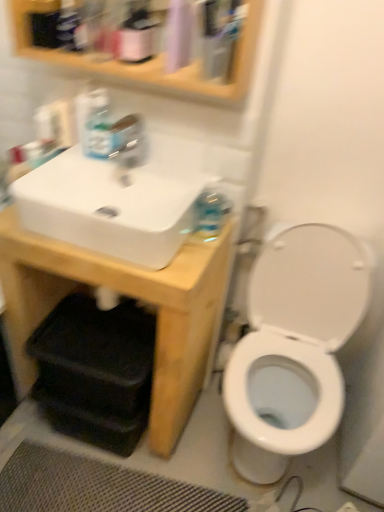
This screenshot has height=512, width=384. In order to click on white matte sink at upper left in this screenshot , I will do `click(128, 296)`.

Where is `clear plastic mouthwash at upper center`? This screenshot has width=384, height=512. clear plastic mouthwash at upper center is located at coordinates (219, 37).

In order to face clear plastic mouthwash at upper center, should I rotate leftwards or rightwards?

Rotate right and turn 3.587 degrees.

The image size is (384, 512). Describe the element at coordinates (115, 202) in the screenshot. I see `white glossy sink at upper left` at that location.

Image resolution: width=384 pixels, height=512 pixels. Find the location of `black textured bath mat at lower center`. black textured bath mat at lower center is located at coordinates (97, 486).

Locate an element on the screen. The height and width of the screenshot is (512, 384). white matte sink at upper left is located at coordinates (128, 296).

In the image, is wooden medicine cabinet at upper center positioned in front of or behind clear plastic mouthwash at upper center?

wooden medicine cabinet at upper center is positioned closer to the viewer than clear plastic mouthwash at upper center.

Between wooden medicine cabinet at upper center and clear plastic mouthwash at upper center, which one has larger width?

With larger width is wooden medicine cabinet at upper center.

Is wooden medicine cabinet at upper center next to clear plastic mouthwash at upper center?

wooden medicine cabinet at upper center and clear plastic mouthwash at upper center are not in contact.

From the image's perspective, would you say wooden medicine cabinet at upper center is positioned over clear plastic mouthwash at upper center?

Indeed, from the image's perspective, wooden medicine cabinet at upper center is shown above clear plastic mouthwash at upper center.

Who is smaller, matte pink spray bottle at upper center or wooden medicine cabinet at upper center?

With smaller size is matte pink spray bottle at upper center.

Is matte pink spray bottle at upper center oriented away from wooden medicine cabinet at upper center?

Absolutely, matte pink spray bottle at upper center is directed away from wooden medicine cabinet at upper center.

From a real-world perspective, does matte pink spray bottle at upper center stand above wooden medicine cabinet at upper center?

Yes.

Between wooden medicine cabinet at upper center and white glossy toilet at right, which one has more height?

With more height is white glossy toilet at right.

Is wooden medicine cabinet at upper center facing away from white glossy toilet at right?

No, white glossy toilet at right is not at the back of wooden medicine cabinet at upper center.

From a real-world perspective, which object stands above the other?

wooden medicine cabinet at upper center.

Which object is further away from the camera, wooden medicine cabinet at upper center or white glossy toilet at right?

Positioned behind is white glossy toilet at right.

Considering the relative positions of black textured bath mat at lower center and transparent plastic tap at upper center in the image provided, is black textured bath mat at lower center to the right of transparent plastic tap at upper center from the viewer's perspective?

No, black textured bath mat at lower center is not to the right of transparent plastic tap at upper center.

At what (x,y) coordinates should I click in order to perform the action: click on tap above the black textured bath mat at lower center (from a real-world perspective). Please return your answer as a coordinate pair (x, y). Looking at the image, I should click on (127, 145).

Between point (155, 478) and point (126, 173), which one is positioned behind?

The point (155, 478) is behind.

From the image's perspective, is black textured bath mat at lower center on transparent plastic tap at upper center?

No, from the image's perspective, black textured bath mat at lower center is not on top of transparent plastic tap at upper center.

The image size is (384, 512). In order to click on cleaning product behind the white glossy toilet at right in this screenshot , I will do `click(137, 34)`.

Choose the correct answer: Is matte pink spray bottle at upper center inside white glossy toilet at right or outside it?

matte pink spray bottle at upper center is spatially situated outside white glossy toilet at right.

In the image, is matte pink spray bottle at upper center positioned in front of or behind white glossy toilet at right?

matte pink spray bottle at upper center is behind white glossy toilet at right.

Considering the sizes of objects matte pink spray bottle at upper center and white glossy toilet at right in the image provided, who is shorter, matte pink spray bottle at upper center or white glossy toilet at right?

matte pink spray bottle at upper center.

Is matte pink spray bottle at upper center thinner than white matte sink at upper left?

Yes, matte pink spray bottle at upper center is thinner than white matte sink at upper left.

Which point is more distant from viewer, (141,28) or (151,426)?

Positioned behind is point (151,426).

From the image's perspective, who appears lower, matte pink spray bottle at upper center or white matte sink at upper left?

white matte sink at upper left.

Locate an element on the screen. This screenshot has height=512, width=384. mouthwash on the right of black textured bath mat at lower center is located at coordinates (219, 37).

From a real-world perspective, is clear plastic mouthwash at upper center under black textured bath mat at lower center?

Actually, clear plastic mouthwash at upper center is physically above black textured bath mat at lower center in the real world.

Locate an element on the screen. The width and height of the screenshot is (384, 512). medicine cabinet located in front of the clear plastic mouthwash at upper center is located at coordinates (150, 61).

Locate an element on the screen. cleaning product located on the left of wooden medicine cabinet at upper center is located at coordinates (137, 34).

Which object lies further to the anchor point matte pink spray bottle at upper center, wooden medicine cabinet at upper center or white glossy sink at upper left?

white glossy sink at upper left.

Based on their spatial positions, is wooden medicine cabinet at upper center or black textured bath mat at lower center further from clear plastic mouthwash at upper center?

black textured bath mat at lower center.

Consider the image. Considering their positions, is white glossy sink at upper left positioned closer to black textured bath mat at lower center than clear plastic mouthwash at upper center?

The object closer to black textured bath mat at lower center is white glossy sink at upper left.

Considering their positions, is matte pink spray bottle at upper center positioned further to wooden medicine cabinet at upper center than white glossy sink at upper left?

Based on the image, white glossy sink at upper left appears to be further to wooden medicine cabinet at upper center.

From the image, which object appears to be farther from white glossy toilet at right, matte pink spray bottle at upper center or white glossy sink at upper left?

matte pink spray bottle at upper center is further to white glossy toilet at right.

Looking at the image, which one is located closer to matte pink spray bottle at upper center, black textured bath mat at lower center or wooden medicine cabinet at upper center?

wooden medicine cabinet at upper center is positioned closer to the anchor matte pink spray bottle at upper center.

When comparing their distances from transparent plastic tap at upper center, does white glossy toilet at right or black textured bath mat at lower center seem closer?

Among the two, white glossy toilet at right is located nearer to transparent plastic tap at upper center.

From the image, which object appears to be nearer to white glossy toilet at right, translucent plastic soap dispenser at upper left or black textured bath mat at lower center?

black textured bath mat at lower center is closer to white glossy toilet at right.

I want to click on toilet between transparent plastic tap at upper center and black textured bath mat at lower center in the vertical direction, so click(294, 347).

Image resolution: width=384 pixels, height=512 pixels. In order to click on tap between wooden medicine cabinet at upper center and white glossy sink at upper left vertically in this screenshot , I will do `click(127, 145)`.

Identify the location of sink between translucent plastic soap dispenser at upper left and clear plastic mouthwash at upper center. (115, 202).

Image resolution: width=384 pixels, height=512 pixels. Identify the location of mouthwash between wooden medicine cabinet at upper center and transparent plastic tap at upper center along the z-axis. (219, 37).